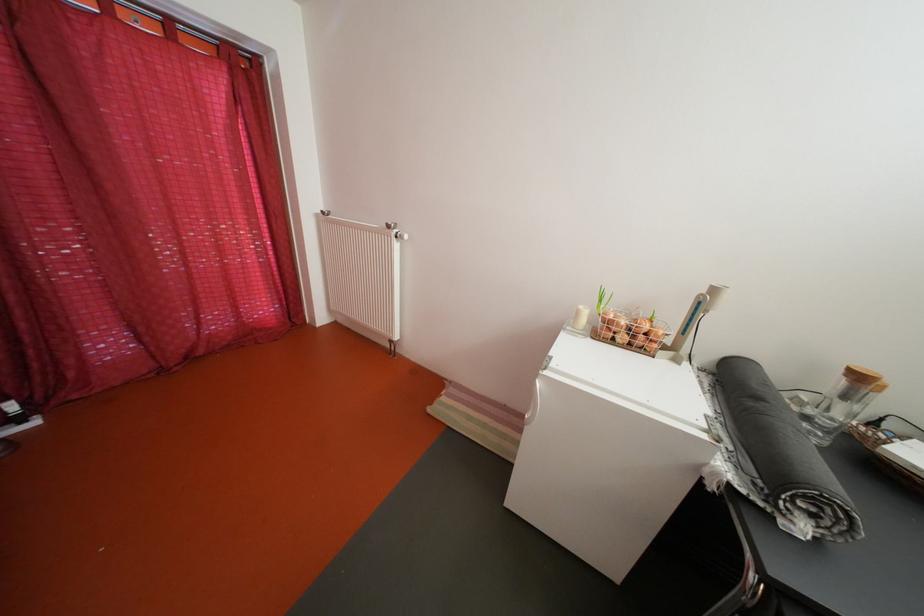
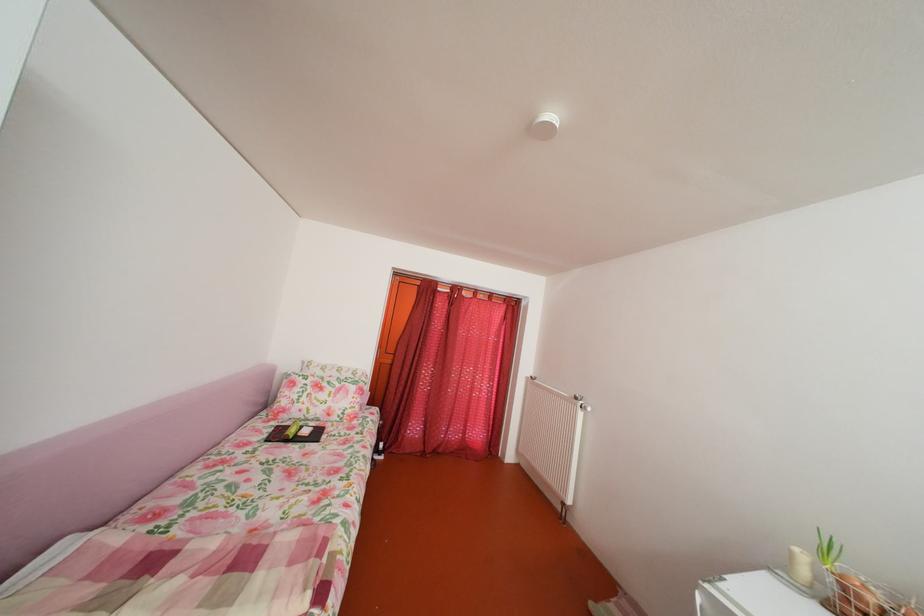
In the second image, find the point that corresponds to point (244, 136) in the first image.

(511, 337)